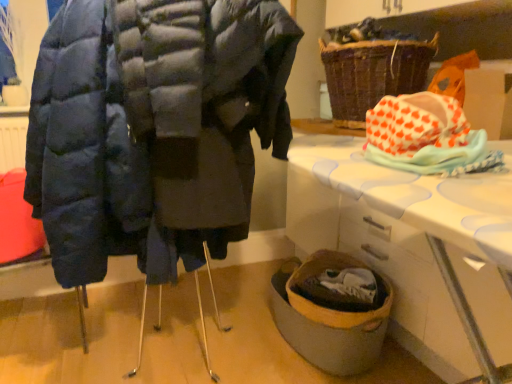
Question: Considering the relative positions of orange heart-patterned fabric at upper right and white plastic table at lower right in the image provided, is orange heart-patterned fabric at upper right to the left or to the right of white plastic table at lower right?

Choices:
 (A) left
 (B) right

Answer: (A)

Question: From a real-world perspective, is orange heart-patterned fabric at upper right above or below white plastic table at lower right?

Choices:
 (A) below
 (B) above

Answer: (B)

Question: Considering the real-world distances, which object is farthest from the white plastic table at lower right?

Choices:
 (A) brown woven basket at upper right
 (B) matte blue puffer coat at left
 (C) orange heart-patterned fabric at upper right

Answer: (B)

Question: Based on their relative distances, which object is farther from the brown woven basket at upper right?

Choices:
 (A) white plastic table at lower right
 (B) matte blue puffer coat at left
 (C) orange heart-patterned fabric at upper right

Answer: (C)